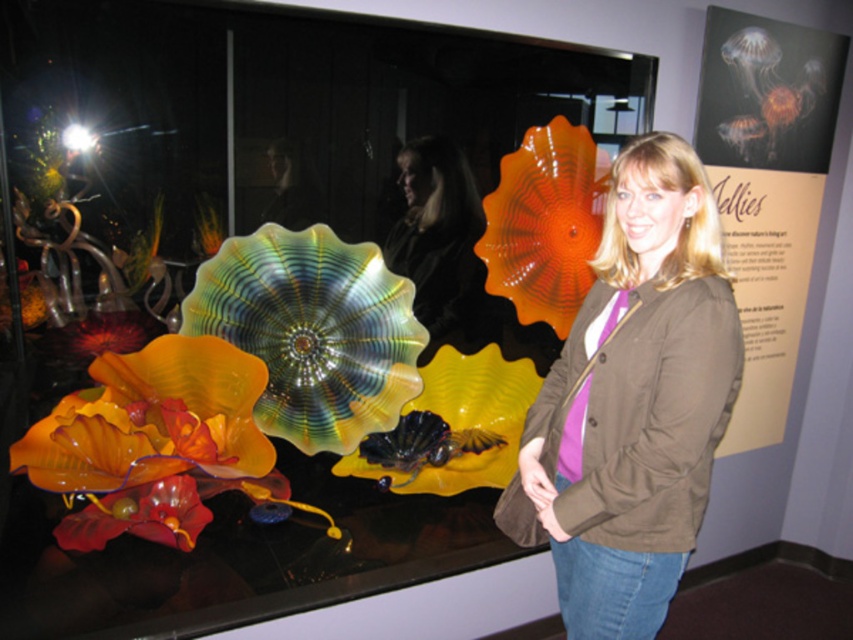
You are an art curator standing in front of the exhibition space. You need to move the translucent glass flower at lower left and the matte black jacket at center to a new display area. Which object should you move first to avoid blocking the view of the other object?

You should move the translucent glass flower at lower left first because it is in front of the matte black jacket at center. Moving it first will prevent it from blocking the view of the matte black jacket at center during the relocation process.

You are a delivery person who needs to place a package between the brown fabric jacket at center and the translucent orange glass flower at center. The package is 20 inches long. Is there enough space between them to place the package?

The distance between the brown fabric jacket at center and the translucent orange glass flower at center is 30.10 inches. Since the package is 20 inches long, there is sufficient space to place it between them.

In the scene shown: You are an art curator arranging items in the exhibition space. You need to ensure that the translucent orange glass flower at center and the matte black jacket at center are positioned correctly according to their descriptions. Which item should be placed higher up?

The matte black jacket at center should be placed higher up because the translucent orange glass flower at center is positioned below it.